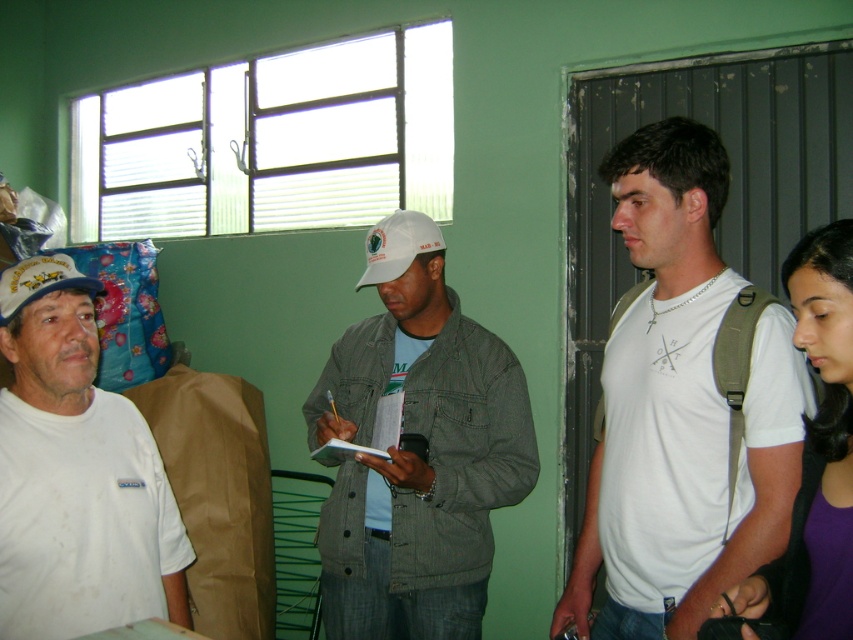
You are standing in the room and want to place a small table at point (363, 387). The table requires 8 feet of space to be placed safely. Is there enough space there?

The distance of point (363, 387) from camera is 7.37 feet, so there is not enough space to place the table safely since it requires 8 feet.